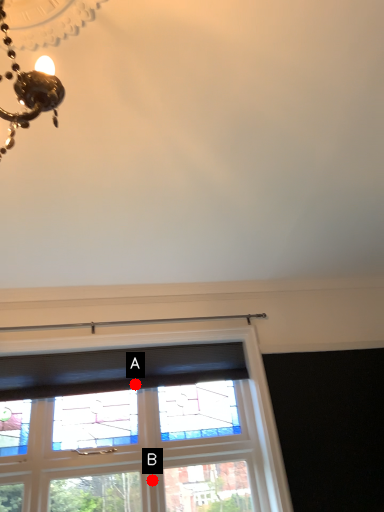
Question: Two points are circled on the image, labeled by A and B beside each circle. Which point is farther from the camera taking this photo?

Choices:
 (A) A is further
 (B) B is further

Answer: (A)